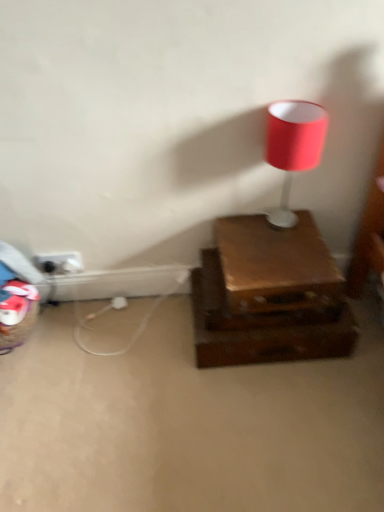
Question: Is matte red lampshade at upper right inside shiny brown drawer at center?

Choices:
 (A) no
 (B) yes

Answer: (A)

Question: From the image's perspective, is shiny brown drawer at center located above matte red lampshade at upper right?

Choices:
 (A) yes
 (B) no

Answer: (B)

Question: Is shiny brown drawer at center oriented away from matte red lampshade at upper right?

Choices:
 (A) no
 (B) yes

Answer: (A)

Question: Can you confirm if shiny brown drawer at center is shorter than matte red lampshade at upper right?

Choices:
 (A) no
 (B) yes

Answer: (B)

Question: Is shiny brown drawer at center positioned behind matte red lampshade at upper right?

Choices:
 (A) yes
 (B) no

Answer: (A)

Question: Are shiny brown drawer at center and matte red lampshade at upper right far apart?

Choices:
 (A) no
 (B) yes

Answer: (A)

Question: From a real-world perspective, is shiny brown drawer at center beneath black plastic outlet at lower left?

Choices:
 (A) no
 (B) yes

Answer: (B)

Question: Is shiny brown drawer at center beside black plastic outlet at lower left?

Choices:
 (A) yes
 (B) no

Answer: (B)

Question: From the image's perspective, would you say shiny brown drawer at center is shown under black plastic outlet at lower left?

Choices:
 (A) yes
 (B) no

Answer: (A)

Question: Is there a large distance between shiny brown drawer at center and black plastic outlet at lower left?

Choices:
 (A) no
 (B) yes

Answer: (A)

Question: Is shiny brown drawer at center thinner than black plastic outlet at lower left?

Choices:
 (A) yes
 (B) no

Answer: (B)

Question: Can you confirm if shiny brown drawer at center is bigger than black plastic outlet at lower left?

Choices:
 (A) yes
 (B) no

Answer: (A)

Question: Is matte red lampshade at upper right looking in the opposite direction of shiny brown drawer at center?

Choices:
 (A) no
 (B) yes

Answer: (A)